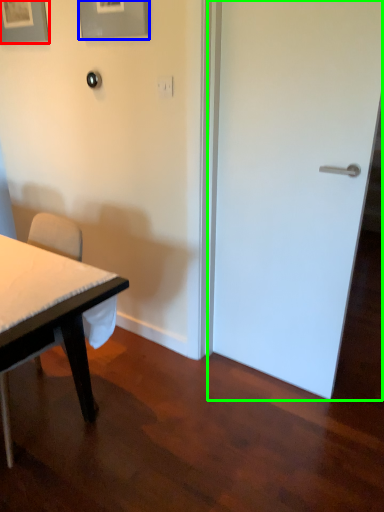
Question: Considering the real-world distances, which object is farthest from picture frame (highlighted by a red box)? picture frame (highlighted by a blue box) or door (highlighted by a green box)?

Choices:
 (A) picture frame
 (B) door

Answer: (B)